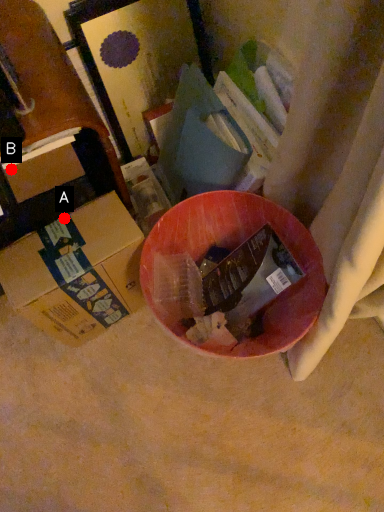
Question: Two points are circled on the image, labeled by A and B beside each circle. Among these points, which one is farthest from the camera?

Choices:
 (A) A is further
 (B) B is further

Answer: (B)